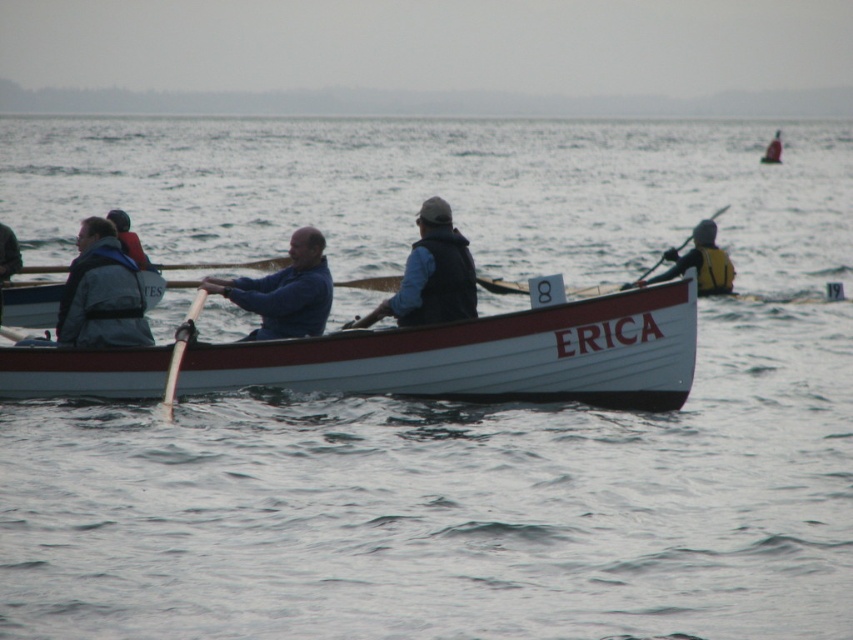
Question: Can you confirm if blue matte jacket at center is positioned below yellow foam paddle at right?

Choices:
 (A) no
 (B) yes

Answer: (B)

Question: Does matte blue life vest at left appear on the left side of yellow foam paddle at right?

Choices:
 (A) yes
 (B) no

Answer: (A)

Question: Which object is closer to the camera taking this photo?

Choices:
 (A) matte gray life vest at left
 (B) white wood paddle at center
 (C) matte blue life vest at left

Answer: (B)

Question: Considering the relative positions of matte blue vest at center and blue fabric jacket at left in the image provided, where is matte blue vest at center located with respect to blue fabric jacket at left?

Choices:
 (A) left
 (B) right

Answer: (B)

Question: Which object is the closest to the matte blue life vest at left?

Choices:
 (A) blue fabric jacket at left
 (B) white wood paddle at center
 (C) gray fabric jacket at left
 (D) yellow foam paddle at right

Answer: (B)

Question: Which of the following is the farthest from the observer?

Choices:
 (A) (18, 260)
 (B) (102, 384)

Answer: (A)